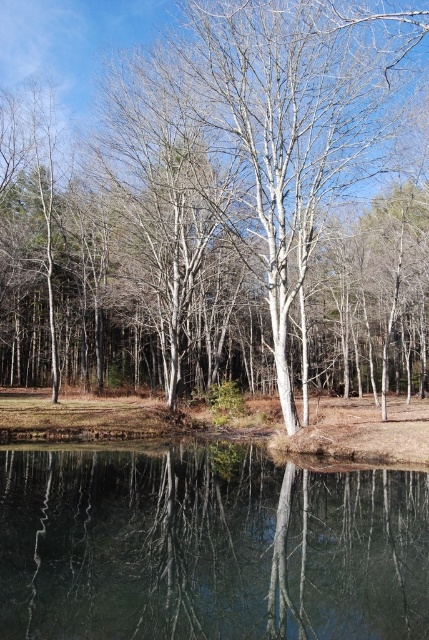
You are standing at the edge of the water in the image. You see the smooth white tree at center and the clear glass water at center. Which object is located to the right of the other?

The smooth white tree at center is positioned on the left side of clear glass water at center, so the clear glass water at center is to the right of the smooth white tree at center.

You are standing on the bank of the lake and see the smooth white tree at center and the clear glass water at center. Which object is closer to you?

The smooth white tree at center is closer to you because it is positioned over the clear glass water at center, meaning it is in front of the water.